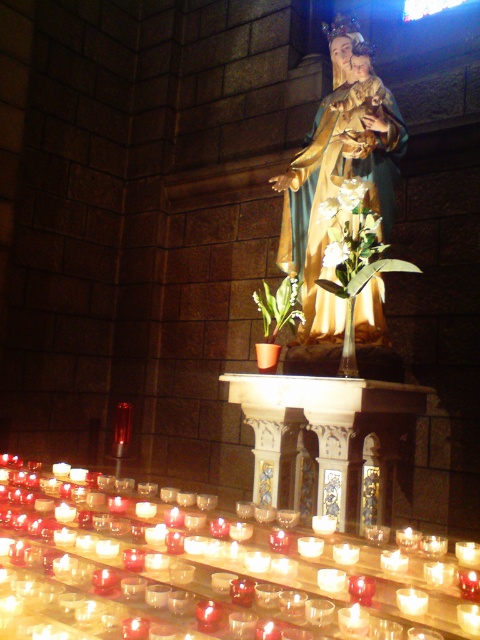
Question: Among these points, which one is farthest from the camera?

Choices:
 (A) (332, 241)
 (B) (381, 310)

Answer: (B)

Question: Does gold polished statue at center have a larger size compared to white matte flower at center?

Choices:
 (A) yes
 (B) no

Answer: (A)

Question: Which point is closer to the camera taking this photo?

Choices:
 (A) (335, 557)
 (B) (336, 241)

Answer: (A)

Question: Does gold polished statue at center appear on the left side of white matte flower at center?

Choices:
 (A) yes
 (B) no

Answer: (B)

Question: Considering the real-world distances, which object is closest to the translucent glass candle at lower left?

Choices:
 (A) gold polished statue at center
 (B) white matte flower at center

Answer: (B)

Question: Where is translucent glass candle at lower left located in relation to gold polished statue at center in the image?

Choices:
 (A) left
 (B) right

Answer: (A)